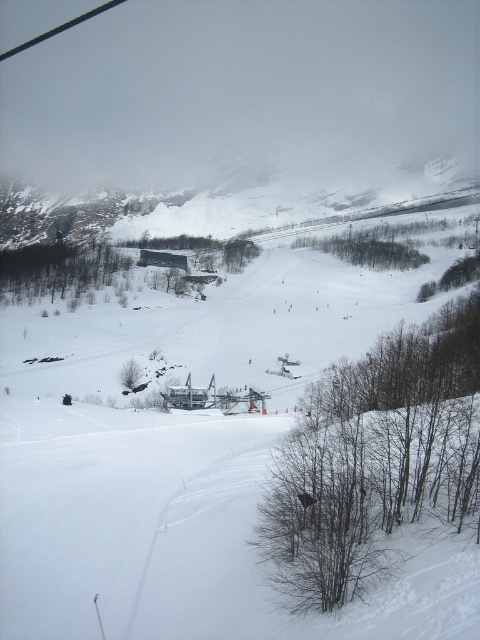
Question: Observing the image, what is the correct spatial positioning of white powdery snow at center in reference to brown textured tree at center?

Choices:
 (A) below
 (B) above

Answer: (A)

Question: Which point is farther to the camera?

Choices:
 (A) white powdery snow at center
 (B) green matte tree at lower left
 (C) brown leafless trees at lower right
 (D) brown textured tree at center

Answer: (D)

Question: Estimate the real-world distances between objects in this image. Which object is closer to the green matte tree at lower left?

Choices:
 (A) brown leafless trees at lower right
 (B) brown textured tree at center
 (C) white powdery snow at center

Answer: (C)

Question: Which of the following is the farthest from the observer?

Choices:
 (A) brown textured tree at center
 (B) white powdery snow at center
 (C) green matte tree at lower left
 (D) brown leafless trees at lower right

Answer: (A)

Question: Does white powdery snow at center lie in front of green matte tree at lower left?

Choices:
 (A) yes
 (B) no

Answer: (A)

Question: Does white powdery snow at center have a lesser width compared to green matte tree at lower left?

Choices:
 (A) yes
 (B) no

Answer: (B)